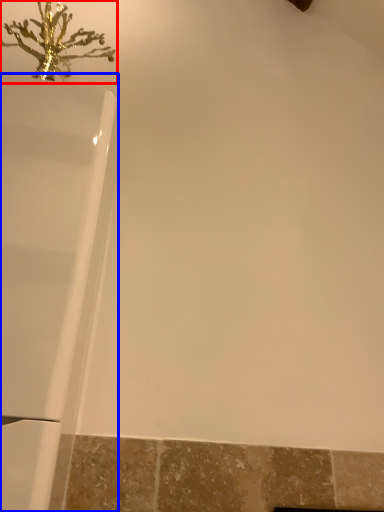
Question: Which point is closer to the camera, christmas decoration (highlighted by a red box) or bathtub (highlighted by a blue box)?

Choices:
 (A) christmas decoration
 (B) bathtub

Answer: (B)